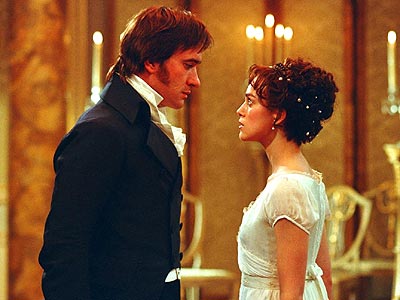
I want to click on wall, so click(x=221, y=160).